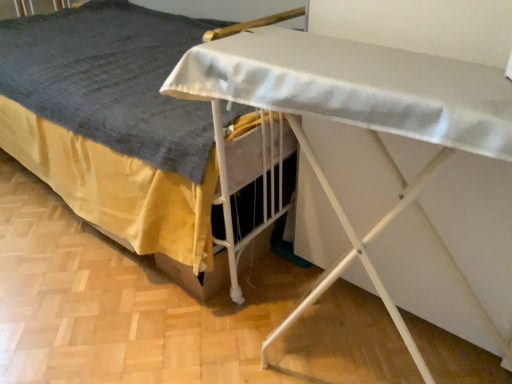
Question: Is white fabric bed at center not near white matte ironing board at lower center?

Choices:
 (A) yes
 (B) no

Answer: (B)

Question: Is white fabric bed at center positioned in front of white matte ironing board at lower center?

Choices:
 (A) no
 (B) yes

Answer: (A)

Question: Can you confirm if white fabric bed at center is positioned to the right of white matte ironing board at lower center?

Choices:
 (A) yes
 (B) no

Answer: (B)

Question: Can you see white fabric bed at center touching white matte ironing board at lower center?

Choices:
 (A) yes
 (B) no

Answer: (B)

Question: Can you confirm if white fabric bed at center is thinner than white matte ironing board at lower center?

Choices:
 (A) no
 (B) yes

Answer: (B)

Question: From the image's perspective, is white fabric bed at center on top of white matte ironing board at lower center?

Choices:
 (A) no
 (B) yes

Answer: (B)

Question: Is white matte ironing board at lower center touching white fabric bed at center?

Choices:
 (A) no
 (B) yes

Answer: (A)

Question: Is white matte ironing board at lower center outside of white fabric bed at center?

Choices:
 (A) no
 (B) yes

Answer: (A)

Question: Considering the relative sizes of white matte ironing board at lower center and white fabric bed at center in the image provided, is white matte ironing board at lower center taller than white fabric bed at center?

Choices:
 (A) no
 (B) yes

Answer: (A)

Question: Can you confirm if white matte ironing board at lower center is bigger than white fabric bed at center?

Choices:
 (A) no
 (B) yes

Answer: (A)

Question: Can you confirm if white matte ironing board at lower center is thinner than white fabric bed at center?

Choices:
 (A) no
 (B) yes

Answer: (A)

Question: Could you tell me if white matte ironing board at lower center is turned towards white fabric bed at center?

Choices:
 (A) no
 (B) yes

Answer: (B)

Question: Considering the positions of white fabric bed at center and white matte ironing board at lower center in the image, is white fabric bed at center wider or thinner than white matte ironing board at lower center?

Choices:
 (A) thin
 (B) wide

Answer: (A)